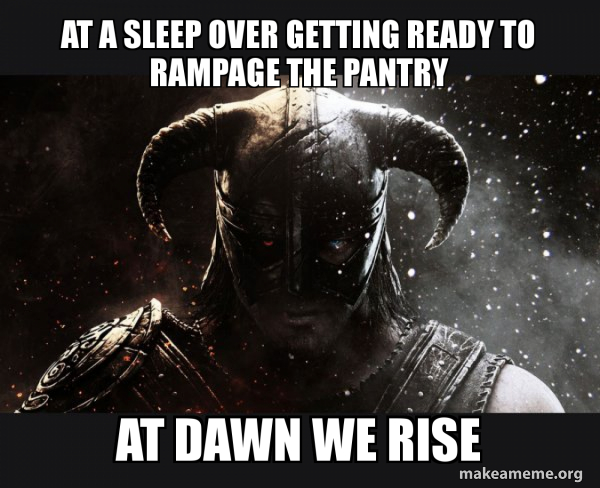
Where is `black stripe below picture`? This screenshot has height=488, width=600. black stripe below picture is located at coordinates (76, 464).